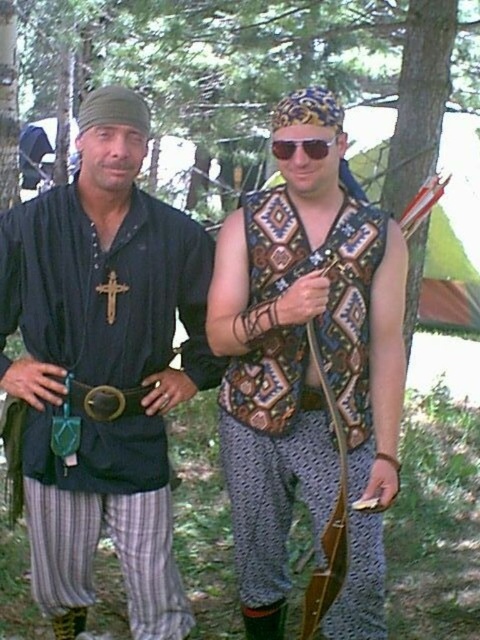
Question: Which point is closer to the camera?

Choices:
 (A) patterned fabric vest at center
 (B) sunglasses at center
 (C) matte black shirt at center

Answer: (C)

Question: Is brown leather belt at center wider than sunglasses at center?

Choices:
 (A) yes
 (B) no

Answer: (A)

Question: Does patterned fabric vest at center appear over sunglasses at center?

Choices:
 (A) no
 (B) yes

Answer: (A)

Question: Which is farther from the brown leather belt at center?

Choices:
 (A) matte black shirt at center
 (B) sunglasses at center
 (C) patterned fabric vest at center

Answer: (B)

Question: Which point is farther to the camera?

Choices:
 (A) matte black shirt at center
 (B) patterned fabric vest at center

Answer: (B)

Question: Where is matte black shirt at center located in relation to patterned fabric vest at center in the image?

Choices:
 (A) above
 (B) below

Answer: (A)